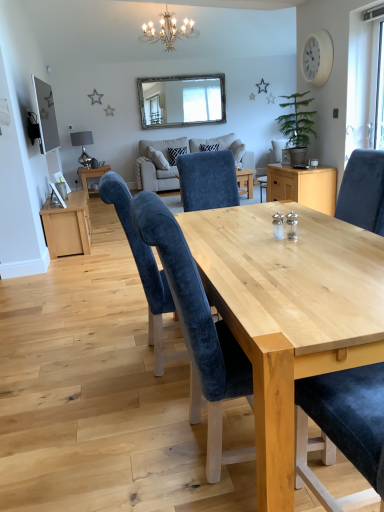
Question: Considering the relative positions of wooden-framed mirror at upper center and velvet blue chair at center, the 2th chair viewed from the back, in the image provided, is wooden-framed mirror at upper center to the left of velvet blue chair at center, the 2th chair viewed from the back, from the viewer's perspective?

Choices:
 (A) yes
 (B) no

Answer: (A)

Question: Is velvet blue chair at center, which ranks as the 1th chair in front-to-back order, at the back of wooden-framed mirror at upper center?

Choices:
 (A) no
 (B) yes

Answer: (A)

Question: Is wooden-framed mirror at upper center taller than velvet blue chair at center, the 2th chair viewed from the back?

Choices:
 (A) yes
 (B) no

Answer: (B)

Question: Does wooden-framed mirror at upper center have a larger size compared to velvet blue chair at center, the 2th chair viewed from the back?

Choices:
 (A) no
 (B) yes

Answer: (A)

Question: From a real-world perspective, does wooden-framed mirror at upper center sit lower than velvet blue chair at center, the 2th chair viewed from the back?

Choices:
 (A) yes
 (B) no

Answer: (B)

Question: Looking at their shapes, would you say velvet blue chair at center, positioned as the 2th chair in front-to-back order, is wider or thinner than wooden table at center?

Choices:
 (A) wide
 (B) thin

Answer: (A)

Question: From a real-world perspective, relative to wooden table at center, is velvet blue chair at center, positioned as the 2th chair in front-to-back order, vertically above or below?

Choices:
 (A) above
 (B) below

Answer: (A)

Question: Considering the positions of velvet blue chair at center, arranged as the first chair when viewed from the back, and wooden table at center in the image, is velvet blue chair at center, arranged as the first chair when viewed from the back, bigger or smaller than wooden table at center?

Choices:
 (A) big
 (B) small

Answer: (A)

Question: Is point (129, 200) closer or farther from the camera than point (77, 173)?

Choices:
 (A) closer
 (B) farther

Answer: (A)

Question: Based on their positions, is wooden-framed mirror at upper center located to the left or right of white plastic clock at upper right?

Choices:
 (A) left
 (B) right

Answer: (A)

Question: From the image's perspective, relative to white plastic clock at upper right, is wooden-framed mirror at upper center above or below?

Choices:
 (A) above
 (B) below

Answer: (A)

Question: Considering their positions, is wooden-framed mirror at upper center located in front of or behind white plastic clock at upper right?

Choices:
 (A) behind
 (B) front

Answer: (A)

Question: From a real-world perspective, is wooden-framed mirror at upper center physically located above or below white plastic clock at upper right?

Choices:
 (A) below
 (B) above

Answer: (A)

Question: Considering the positions of silver metallic chandelier at upper center and transparent glass window at upper right in the image, is silver metallic chandelier at upper center taller or shorter than transparent glass window at upper right?

Choices:
 (A) short
 (B) tall

Answer: (A)

Question: Considering the positions of silver metallic chandelier at upper center and transparent glass window at upper right in the image, is silver metallic chandelier at upper center bigger or smaller than transparent glass window at upper right?

Choices:
 (A) big
 (B) small

Answer: (A)